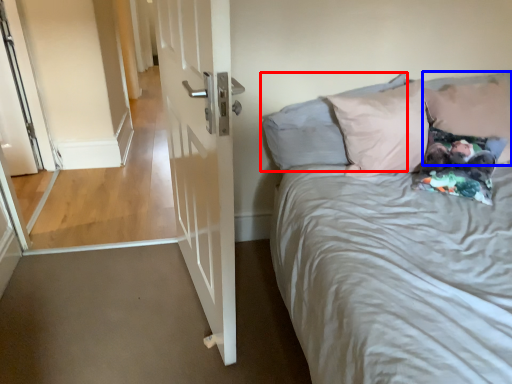
Question: Which object is closer to the camera taking this photo, pillow (highlighted by a red box) or pillow (highlighted by a blue box)?

Choices:
 (A) pillow
 (B) pillow

Answer: (A)